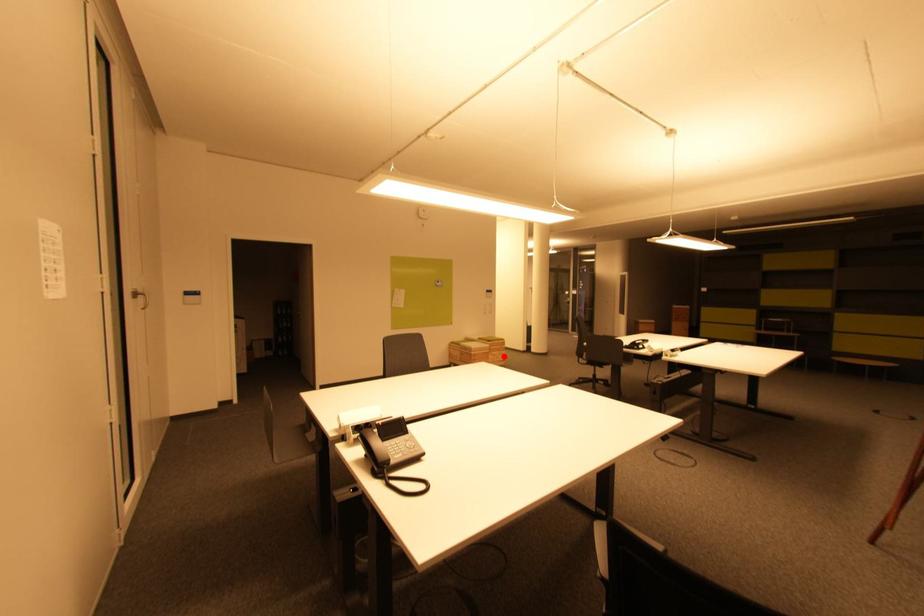
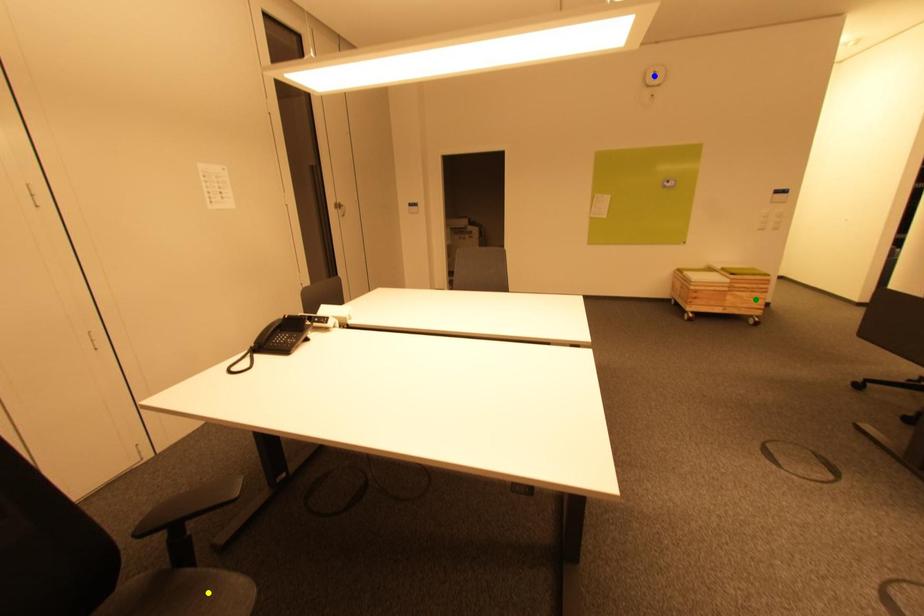
Question: I am providing you with two images of the same scene from different viewpoints. A red point is marked on the first image. You are given multiple points on the second image. Which mark in image 2 goes with the point in image 1?

Choices:
 (A) green point
 (B) yellow point
 (C) blue point

Answer: (A)